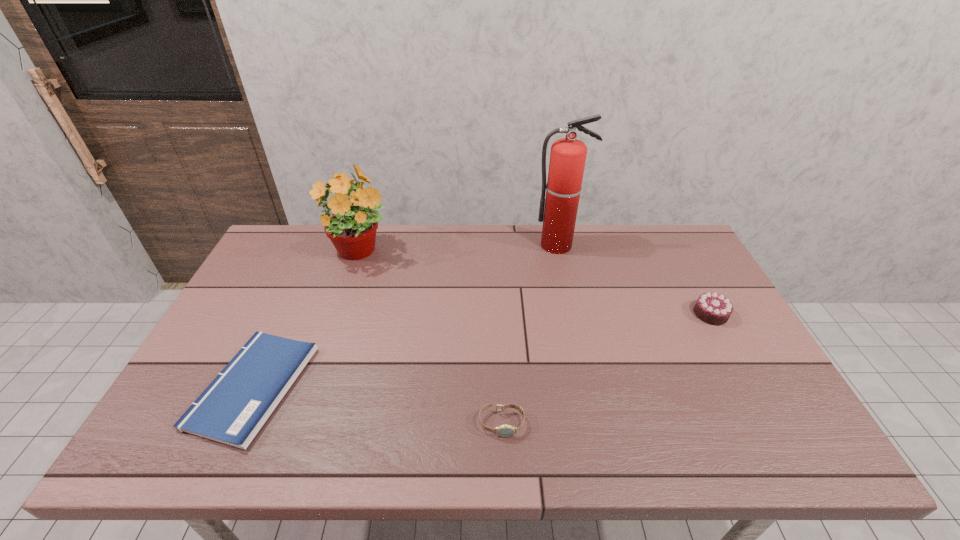
The width and height of the screenshot is (960, 540). Identify the location of vacant space located on the left of the rightmost object. (621, 314).

Image resolution: width=960 pixels, height=540 pixels. Identify the location of free spot located 0.050m on the back of the paperback book. (282, 322).

What are the coordinates of `fire extinguisher that is at the far edge` in the screenshot? It's located at (568, 155).

Where is `flowerpot located at the far edge`? flowerpot located at the far edge is located at coordinates (350, 222).

At what (x,y) coordinates should I click in order to perform the action: click on watch that is at the near edge. Please return your answer as a coordinate pair (x, y). Image resolution: width=960 pixels, height=540 pixels. Looking at the image, I should click on (505, 430).

Where is `paperback book present at the near edge`? The height and width of the screenshot is (540, 960). paperback book present at the near edge is located at coordinates (233, 408).

This screenshot has width=960, height=540. In order to click on object located in the left edge section of the desktop in this screenshot , I will do `click(233, 408)`.

Locate an element on the screen. The height and width of the screenshot is (540, 960). object that is at the right edge is located at coordinates (712, 308).

The width and height of the screenshot is (960, 540). I want to click on object at the near left corner, so click(233, 408).

You are a GUI agent. You are given a task and a screenshot of the screen. Output one action in this format:
    pyautogui.click(x=<x>, y=<y>)
    Task: Click on the vacant space at the far edge of the desktop
    
    Given the screenshot: What is the action you would take?
    527,232